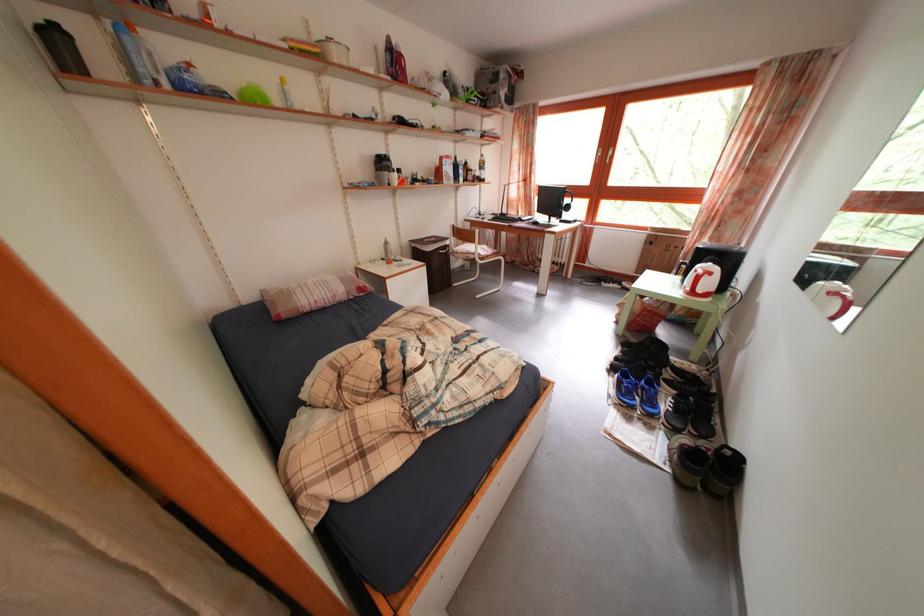
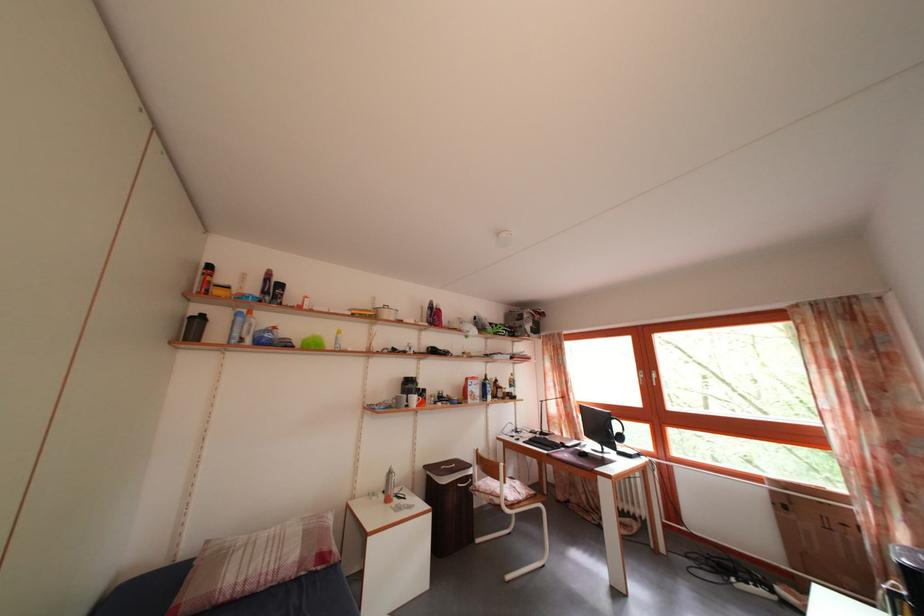
Find the pixel in the second image that matches the point at 611,160 in the first image.

(652, 382)